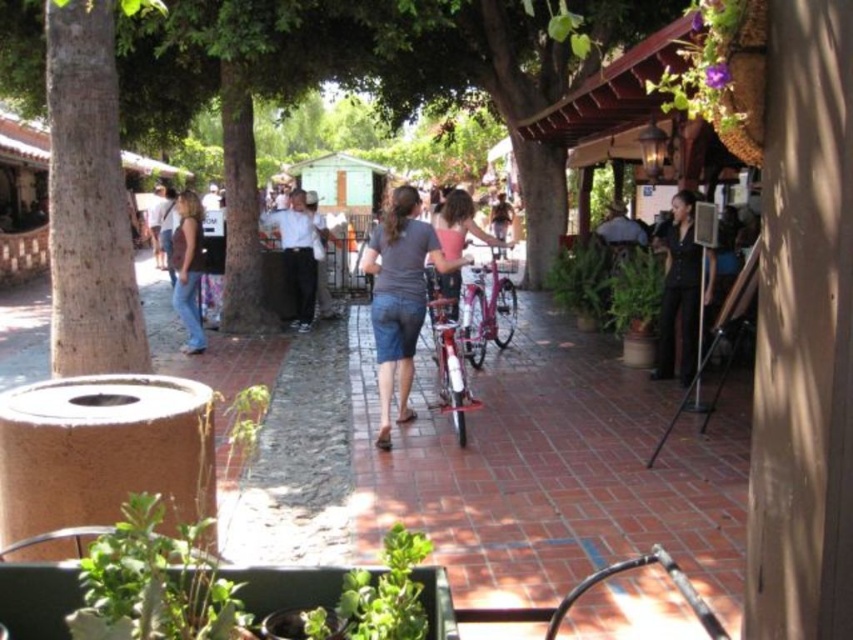
Question: Which point is closer to the camera?

Choices:
 (A) brick pavement at center
 (B) green leafy plant at center
 (C) denim shorts at center

Answer: (A)

Question: Can you confirm if denim shorts at center is positioned below denim jeans at center?

Choices:
 (A) no
 (B) yes

Answer: (B)

Question: Does denim shorts at center have a smaller size compared to white shirt at center?

Choices:
 (A) yes
 (B) no

Answer: (A)

Question: Which point is farther to the camera?

Choices:
 (A) denim jeans at center
 (B) green leafy plant at right
 (C) brick pavement at center
 (D) black leather dress at right

Answer: (A)

Question: Considering the real-world distances, which object is closest to the green leafy plant at right?

Choices:
 (A) green leafy plant at center
 (B) brick pavement at center
 (C) denim shorts at center
 (D) brown textured tree trunk at left

Answer: (A)

Question: In this image, where is white shirt at center located relative to green leafy plant at right?

Choices:
 (A) above
 (B) below

Answer: (A)